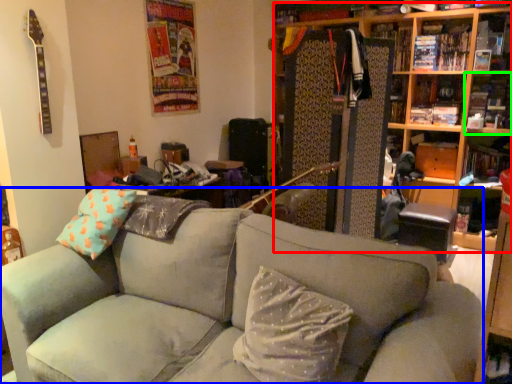
Question: Which is farther away from bookcase (highlighted by a red box)? studio couch (highlighted by a blue box) or shelf (highlighted by a green box)?

Choices:
 (A) studio couch
 (B) shelf

Answer: (A)